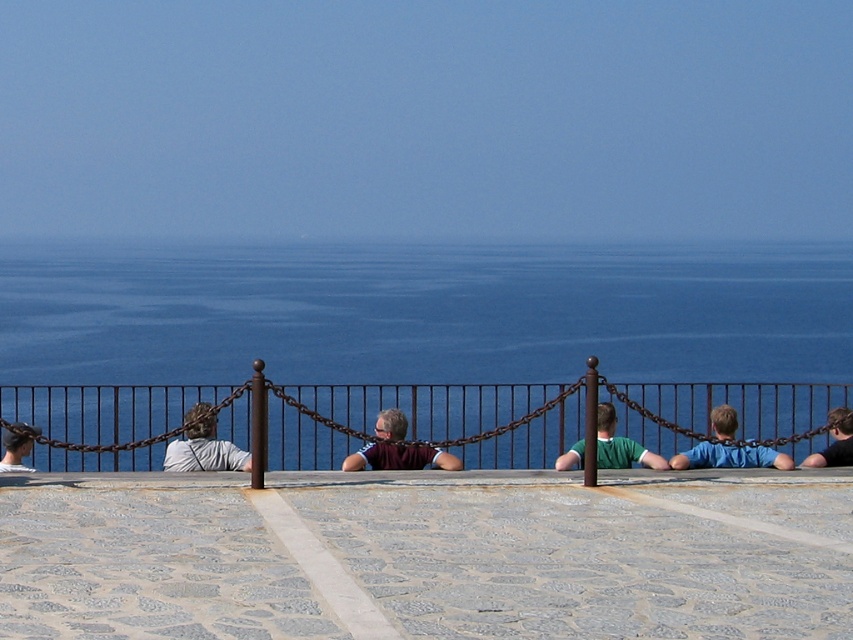
Question: Can you confirm if blue shirt at center is positioned to the right of green fabric shirt at center?

Choices:
 (A) yes
 (B) no

Answer: (A)

Question: Which point is farther to the camera?

Choices:
 (A) blue shirt at center
 (B) green fabric shirt at center

Answer: (A)

Question: Which of the following is the closest to the observer?

Choices:
 (A) maroon shirt at center
 (B) gray fabric shirt at left

Answer: (B)

Question: Among these objects, which one is nearest to the camera?

Choices:
 (A) dark blue shirt at center
 (B) green fabric shirt at center
 (C) blue water at center

Answer: (C)

Question: Is blue water at center to the right of dark blue shirt at center from the viewer's perspective?

Choices:
 (A) yes
 (B) no

Answer: (B)

Question: From the image, what is the correct spatial relationship of gray fabric shirt at left in relation to matte black hair at left?

Choices:
 (A) above
 (B) below

Answer: (A)